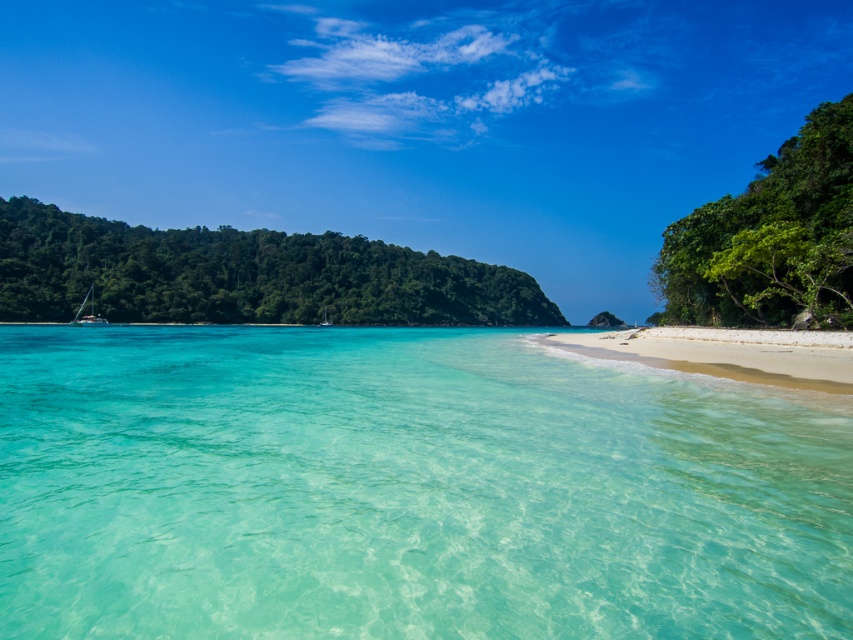
You are standing on the beach looking out at the turquoise waters. There is a point marked at coordinates (245,275). What does this point indicate?

The point at coordinates (245,275) corresponds to a green leafy island at left.

You are planning to take a photo of the white glossy boat at center and the green leafy island at left from a position on the beach. Considering their sizes, which object should you focus on to ensure both are visible in the frame without needing to zoom in or out?

The green leafy island at left is bigger than the white glossy boat at center, so focusing on the island will ensure the boat also fits in the frame without needing to adjust the zoom.

You are standing on the white sand beach at lower right and want to reach the green leafy island at left. Given that the average human walking speed is 3 miles per hour, how many minutes would it take to walk directly to the island?

The green leafy island at left is 622.93 feet away from the white sand beach at lower right. Converting feet to miles, 622.93 feet is approximately 0.118 miles. At a walking speed of 3 mph, it would take roughly 0.118 miles divided by 3 mph equals 0.039 hours. Multiplying by 60 minutes gives about 2.36 minutes, so approximately 2 to 3 minutes.